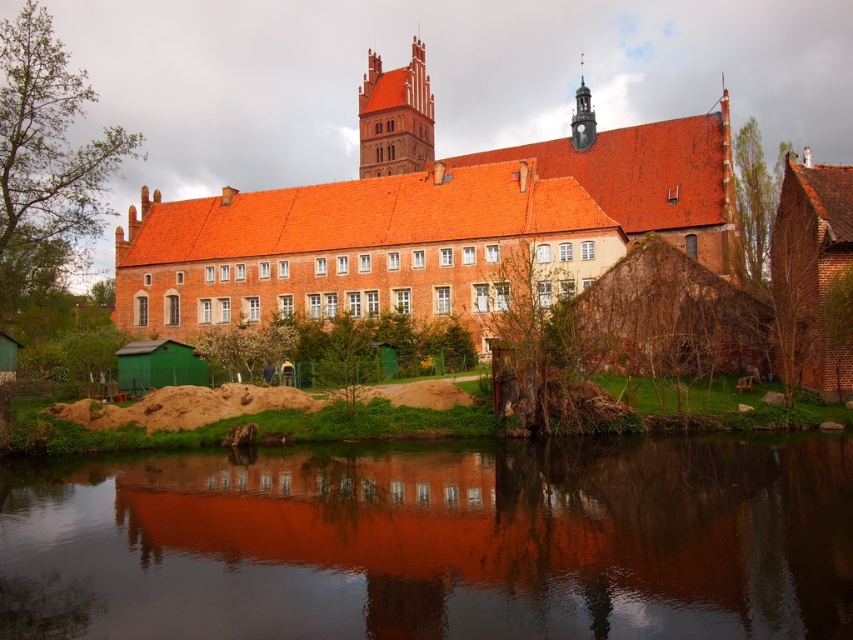
Question: Does smooth water at center appear under reddish-brown brick church at center?

Choices:
 (A) yes
 (B) no

Answer: (A)

Question: Does smooth water at center appear under matte brick tower at upper center?

Choices:
 (A) yes
 (B) no

Answer: (A)

Question: Which of the following is the closest to the observer?

Choices:
 (A) matte brick tower at upper center
 (B) smooth water at center

Answer: (B)

Question: Is smooth water at center wider than matte brick tower at upper center?

Choices:
 (A) no
 (B) yes

Answer: (B)

Question: Which point is closer to the camera taking this photo?

Choices:
 (A) (401, 100)
 (B) (80, 577)
 (C) (425, 156)

Answer: (B)

Question: Which point is closer to the camera?

Choices:
 (A) (160, 580)
 (B) (409, 164)

Answer: (A)